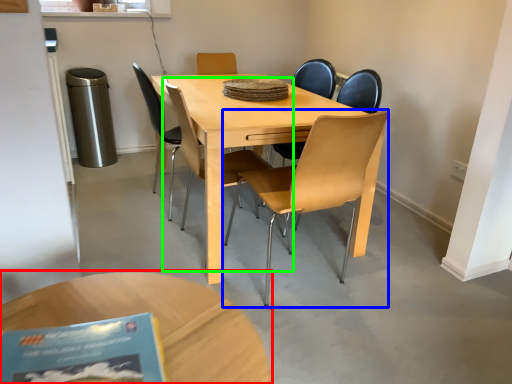
Question: Based on their relative distances, which object is farther from coffee table (highlighted by a red box)? Choose from chair (highlighted by a blue box) and chair (highlighted by a green box).

Choices:
 (A) chair
 (B) chair

Answer: (B)